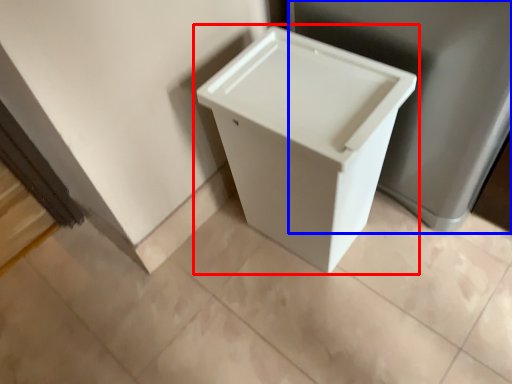
Question: Which of the following is the closest to the observer, waste container (highlighted by a red box) or porcelain (highlighted by a blue box)?

Choices:
 (A) waste container
 (B) porcelain

Answer: (B)